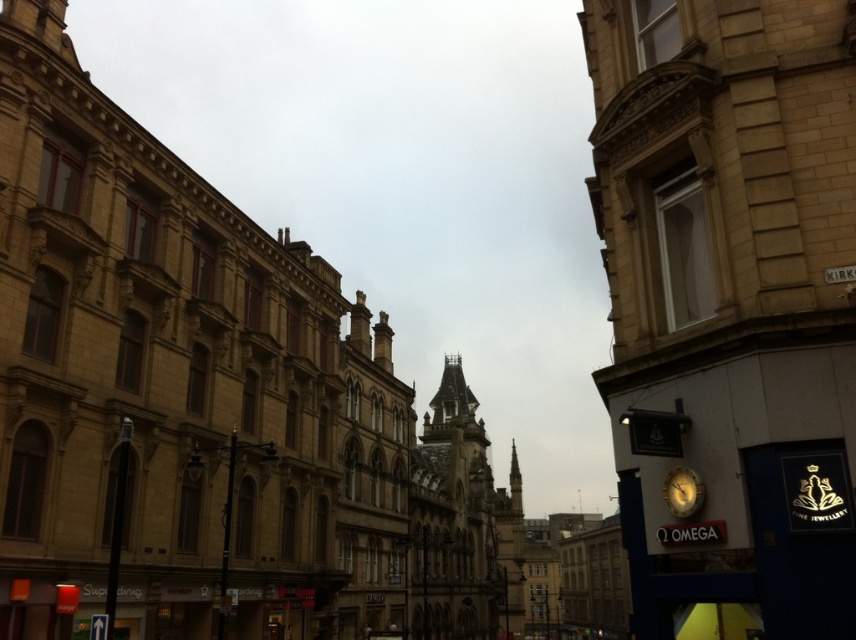
Is stone gothic tower at center wider than gold metallic clock at center right?

Yes, stone gothic tower at center is wider than gold metallic clock at center right.

Describe the element at coordinates (461, 524) in the screenshot. I see `stone gothic tower at center` at that location.

Is point (458, 380) positioned in front of point (699, 497)?

No, it is behind (699, 497).

The height and width of the screenshot is (640, 856). I want to click on stone gothic tower at center, so click(x=461, y=524).